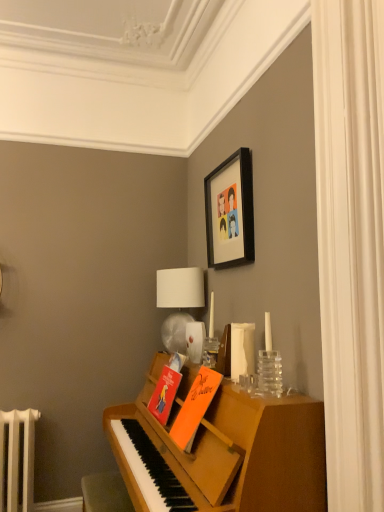
Image resolution: width=384 pixels, height=512 pixels. I want to click on white fabric lampshade at upper center, so 178,303.

Describe the element at coordinates (178, 303) in the screenshot. I see `white fabric lampshade at upper center` at that location.

You are a GUI agent. You are given a task and a screenshot of the screen. Output one action in this format:
    pyautogui.click(x=<x>, y=<y>)
    Task: Click on the black matte picture frame at upper center
    This screenshot has width=384, height=512.
    Given the screenshot: What is the action you would take?
    (230, 212)

Where is `clear glass vase at right`? This screenshot has height=512, width=384. clear glass vase at right is located at coordinates click(270, 373).

What do you see at coordinates (270, 373) in the screenshot?
I see `clear glass vase at right` at bounding box center [270, 373].

At what (x,y) coordinates should I click in order to perform the action: click on white fabric lampshade at upper center. Please return your answer as a coordinate pair (x, y). This screenshot has height=512, width=384. Looking at the image, I should click on (178, 303).

Looking at this image, are white fabric lampshade at upper center and black matte picture frame at upper center beside each other?

There is a gap between white fabric lampshade at upper center and black matte picture frame at upper center.

Is white fabric lampshade at upper center facing away from black matte picture frame at upper center?

That's not correct — white fabric lampshade at upper center is not looking away from black matte picture frame at upper center.

You are a GUI agent. You are given a task and a screenshot of the screen. Output one action in this format:
    pyautogui.click(x=<x>, y=<y>)
    Task: Click on the table lamp below the black matte picture frame at upper center (from the image's perspective)
    
    Given the screenshot: What is the action you would take?
    pyautogui.click(x=178, y=303)

Considering the relative positions of white fabric lampshade at upper center and black matte picture frame at upper center in the image provided, is white fabric lampshade at upper center to the left or to the right of black matte picture frame at upper center?

white fabric lampshade at upper center is positioned on black matte picture frame at upper center's left side.

From a real-world perspective, is clear glass vase at right above or below black matte picture frame at upper center?

From a real-world perspective, clear glass vase at right is physically below black matte picture frame at upper center.

Can you see clear glass vase at right touching black matte picture frame at upper center?

No.

Where is `picture frame that is on the left side of clear glass vase at right`? Image resolution: width=384 pixels, height=512 pixels. picture frame that is on the left side of clear glass vase at right is located at coordinates (230, 212).

Between clear glass vase at right and black matte picture frame at upper center, which one is positioned in front?

clear glass vase at right is in front.

Are black matte picture frame at upper center and white fabric curtain at right located far from each other?

Actually, black matte picture frame at upper center and white fabric curtain at right are a little close together.

Is black matte picture frame at upper center oriented away from white fabric curtain at right?

That's not correct — black matte picture frame at upper center is not looking away from white fabric curtain at right.

Is point (206, 182) positioned before point (339, 65)?

No, it is not.

From the image's perspective, who appears lower, black matte picture frame at upper center or white fabric curtain at right?

white fabric curtain at right, from the image's perspective.

Where is `the 1st book behind the white fabric curtain at right`? This screenshot has height=512, width=384. the 1st book behind the white fabric curtain at right is located at coordinates (194, 407).

From the picture: Is white fabric curtain at right not within orange matte book at center, the 2th book when ordered from back to front?

Absolutely, white fabric curtain at right is external to orange matte book at center, the 2th book when ordered from back to front.

From a real-world perspective, who is located higher, white fabric curtain at right or orange matte book at center, the 1th book from the front?

white fabric curtain at right is physically above.

Is point (368, 308) more distant than point (203, 383)?

No, (368, 308) is in front of (203, 383).

Between clear glass vase at right and white fabric curtain at right, which one has less height?

clear glass vase at right is shorter.

Which object is wider, clear glass vase at right or white fabric curtain at right?

clear glass vase at right is wider.

In terms of size, does clear glass vase at right appear bigger or smaller than white fabric curtain at right?

Considering their sizes, clear glass vase at right takes up less space than white fabric curtain at right.

Can you tell me how much clear glass vase at right and white fabric curtain at right differ in facing direction?

The angular difference between clear glass vase at right and white fabric curtain at right is 1.58 degrees.

Which object is closer to the camera taking this photo, white fabric curtain at right or clear glass vase at right?

white fabric curtain at right is more forward.

Between white fabric curtain at right and clear glass vase at right, which one has larger size?

white fabric curtain at right.

Is clear glass vase at right surrounded by white fabric curtain at right?

Definitely not — clear glass vase at right is not inside white fabric curtain at right.

Is orange matte book at center, the 2th book when ordered from back to front, in front of or behind white fabric lampshade at upper center in the image?

orange matte book at center, the 2th book when ordered from back to front, is in front of white fabric lampshade at upper center.

Which of these two, orange matte book at center, the 1th book from the front, or white fabric lampshade at upper center, is thinner?

Thinner between the two is white fabric lampshade at upper center.

Is orange matte book at center, the 2th book when ordered from back to front, facing towards white fabric lampshade at upper center?

No, orange matte book at center, the 2th book when ordered from back to front, is not oriented towards white fabric lampshade at upper center.

Looking at this image, can we say orange matte book at center, the 2th book when ordered from back to front, lies outside white fabric lampshade at upper center?

Yes, orange matte book at center, the 2th book when ordered from back to front, is located beyond the bounds of white fabric lampshade at upper center.

Where is `table lamp on the left of black matte picture frame at upper center`? The width and height of the screenshot is (384, 512). table lamp on the left of black matte picture frame at upper center is located at coordinates (178, 303).

You are a GUI agent. You are given a task and a screenshot of the screen. Output one action in this format:
    pyautogui.click(x=<x>, y=<y>)
    Task: Click on the glass vase on the right of black matte picture frame at upper center
    The image size is (384, 512).
    Given the screenshot: What is the action you would take?
    pyautogui.click(x=270, y=373)

Looking at the image, which one is located further to clear glass vase at right, black matte picture frame at upper center or orange matte book at center, the 1th book from the front?

black matte picture frame at upper center is further to clear glass vase at right.

Considering their positions, is white fabric lampshade at upper center positioned closer to white fabric curtain at right than black matte picture frame at upper center?

The object closer to white fabric curtain at right is black matte picture frame at upper center.

Based on their spatial positions, is white fabric lampshade at upper center or orange matte book at center, the 1th book from the front, further from black matte picture frame at upper center?

orange matte book at center, the 1th book from the front.

Looking at the image, which one is located closer to orange matte book at center, the 2th book when ordered from back to front, white fabric lampshade at upper center or clear glass vase at right?

clear glass vase at right lies closer to orange matte book at center, the 2th book when ordered from back to front, than the other object.

When comparing their distances from white fabric curtain at right, does black matte picture frame at upper center or orange matte book at center, the 1th book from the front, seem further?

Based on the image, black matte picture frame at upper center appears to be further to white fabric curtain at right.

Estimate the real-world distances between objects in this image. Which object is closer to white fabric lampshade at upper center, matte orange book at center, acting as the first book starting from the back, or white fabric curtain at right?

matte orange book at center, acting as the first book starting from the back, is closer to white fabric lampshade at upper center.

When comparing their distances from clear glass vase at right, does black matte picture frame at upper center or matte orange book at center, which is the second book in front-to-back order, seem further?

Among the two, black matte picture frame at upper center is located further to clear glass vase at right.

Looking at the image, which one is located further to clear glass vase at right, orange matte book at center, the 2th book when ordered from back to front, or matte orange book at center, which is the second book in front-to-back order?

Among the two, matte orange book at center, which is the second book in front-to-back order, is located further to clear glass vase at right.

The height and width of the screenshot is (512, 384). Find the location of `glass vase between white fabric curtain at right and orange matte book at center, the 1th book from the front, in the vertical direction`. glass vase between white fabric curtain at right and orange matte book at center, the 1th book from the front, in the vertical direction is located at coordinates (270, 373).

The image size is (384, 512). I want to click on picture frame between clear glass vase at right and white fabric lampshade at upper center along the z-axis, so click(230, 212).

You are a GUI agent. You are given a task and a screenshot of the screen. Output one action in this format:
    pyautogui.click(x=<x>, y=<y>)
    Task: Click on the table lamp between black matte picture frame at upper center and matte orange book at center, which is the second book in front-to-back order, in the vertical direction
    This screenshot has width=384, height=512.
    Given the screenshot: What is the action you would take?
    pyautogui.click(x=178, y=303)

Locate an element on the screen. glass vase between black matte picture frame at upper center and matte orange book at center, which is the second book in front-to-back order, from top to bottom is located at coordinates (270, 373).